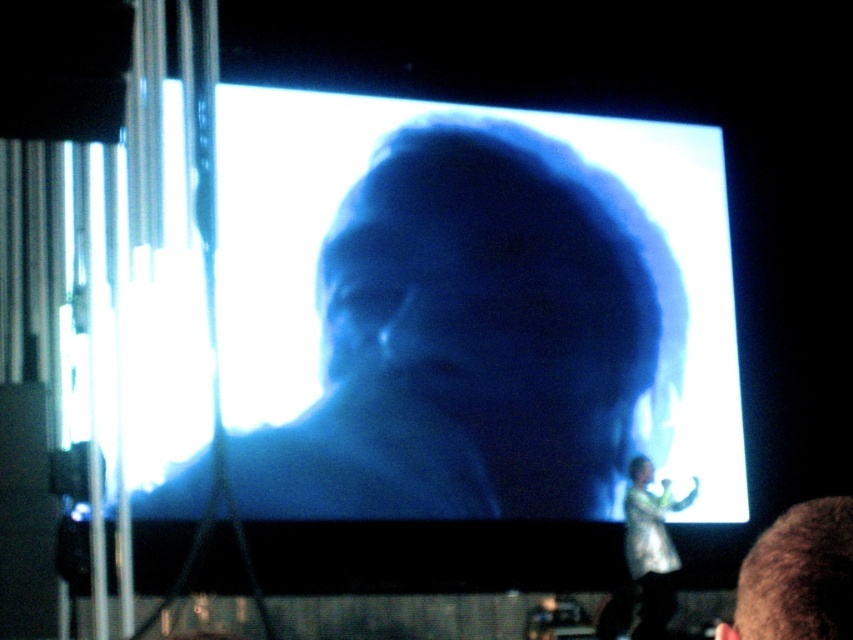
You are an event planner checking the stage setup. You notice the blue matte face at center and the brown hair at lower right on the screen. Which one takes up more space on the screen?

The blue matte face at center is bigger than brown hair at lower right, so it takes up more space on the screen.

You are a stagehand who needs to place a 3.5 feet wide decorative panel between the blue matte face at center and the translucent white dress at lower right. Can you fit it there?

The distance between the blue matte face at center and the translucent white dress at lower right is 3.76 feet, so yes, the 3.5 feet wide decorative panel can fit between them since it is narrower than the available space.

You are an audience member sitting in the front row of the presentation. You notice two items at the lower right of your view. Which one is closer to you between the brown hair at lower right and the translucent white dress at lower right?

The brown hair at lower right is closer to the viewer than the translucent white dress at lower right according to the description.